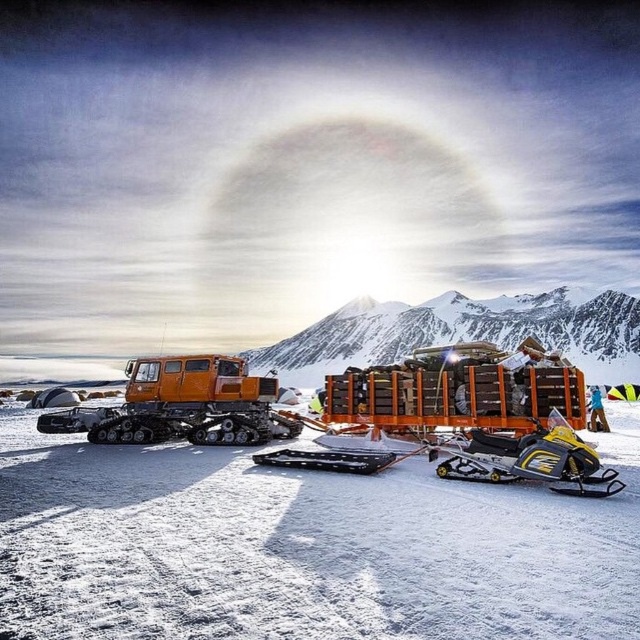
Question: Can you confirm if white powdery snow at center is wider than orange metallic tracked vehicle at left?

Choices:
 (A) no
 (B) yes

Answer: (B)

Question: Which object appears farthest from the camera in this image?

Choices:
 (A) yellow matte snowmobile at lower right
 (B) white powdery snow at center
 (C) snowy rocky mountain at upper center

Answer: (C)

Question: Which point is farther to the camera?

Choices:
 (A) yellow matte snowmobile at lower right
 (B) white powdery snow at center

Answer: (A)

Question: Is white powdery snow at center in front of snowy rocky mountain at upper center?

Choices:
 (A) no
 (B) yes

Answer: (B)

Question: Which of the following is the farthest from the observer?

Choices:
 (A) orange metallic tracked vehicle at left
 (B) white powdery snow at center
 (C) yellow matte snowmobile at lower right
 (D) snowy rocky mountain at upper center

Answer: (D)

Question: In this image, where is white powdery snow at center located relative to orange metallic tracked vehicle at left?

Choices:
 (A) right
 (B) left

Answer: (A)